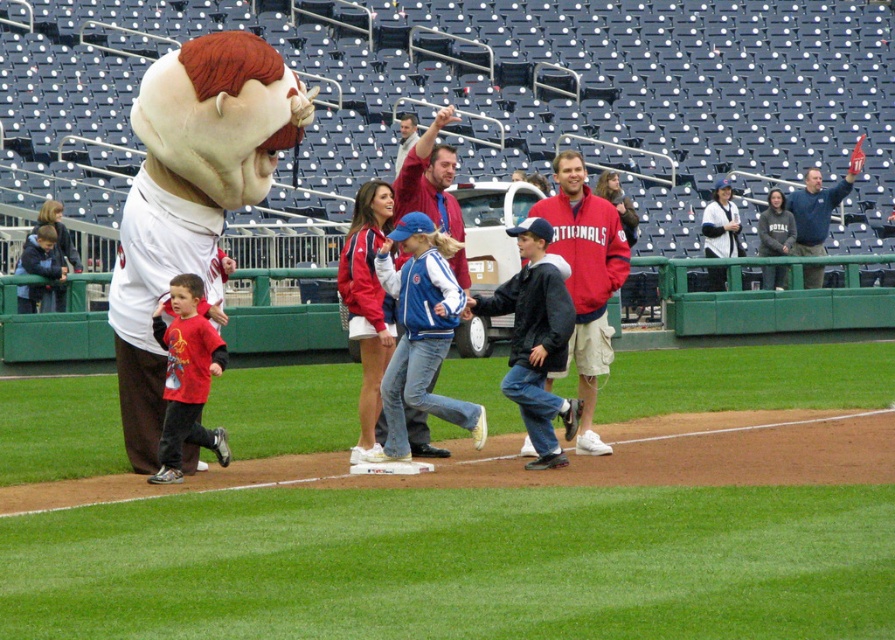
Question: Does reddish-brown fleece jacket at center have a greater width compared to dark gray hoodie at upper right?

Choices:
 (A) no
 (B) yes

Answer: (B)

Question: Considering the real-world distances, which object is closest to the blue fleece jacket at center?

Choices:
 (A) dark gray hoodie at upper right
 (B) red matte shirt at left

Answer: (B)

Question: Which point is farther to the camera?

Choices:
 (A) red matte shirt at left
 (B) red jacket at center
 (C) blue fleece jacket at center

Answer: (B)

Question: In this image, where is black jacket at center located relative to red jacket at center?

Choices:
 (A) above
 (B) below

Answer: (B)

Question: Considering the relative positions of reddish-brown fleece jacket at center and red matte shirt at left in the image provided, where is reddish-brown fleece jacket at center located with respect to red matte shirt at left?

Choices:
 (A) below
 (B) above

Answer: (B)

Question: Which object appears closest to the camera in this image?

Choices:
 (A) blue fleece jacket at upper right
 (B) green grass at center

Answer: (B)